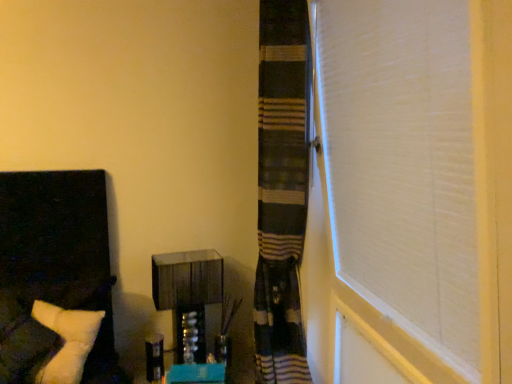
What is the approximate height of metallic glass vanity at center?

18.36 inches.

The width and height of the screenshot is (512, 384). Describe the element at coordinates (188, 290) in the screenshot. I see `metallic glass vanity at center` at that location.

Find the location of `metallic glass vanity at center`. metallic glass vanity at center is located at coordinates (188, 290).

The image size is (512, 384). I want to click on white soft pillow at left, so pos(54,268).

The width and height of the screenshot is (512, 384). What do you see at coordinates (54, 268) in the screenshot? I see `white soft pillow at left` at bounding box center [54, 268].

What are the coordinates of `metallic glass vanity at center` in the screenshot? It's located at (188, 290).

Based on their positions, is metallic glass vanity at center located to the left or right of white soft pillow at left?

metallic glass vanity at center is to the right of white soft pillow at left.

Does metallic glass vanity at center come in front of white soft pillow at left?

That is False.

Is point (178, 360) closer or farther from the camera than point (7, 341)?

Point (178, 360) is farther from the camera than point (7, 341).

From the image's perspective, is metallic glass vanity at center above white soft pillow at left?

No, from the image's perspective, metallic glass vanity at center is not on top of white soft pillow at left.

From a real-world perspective, which object stands above the other?

In real-world perspective, white soft pillow at left is above.

Between metallic glass vanity at center and white soft pillow at left, which one has smaller width?

With smaller width is metallic glass vanity at center.

Considering the sizes of objects metallic glass vanity at center and white soft pillow at left in the image provided, who is taller, metallic glass vanity at center or white soft pillow at left?

white soft pillow at left is taller.

Consider the image. Is metallic glass vanity at center bigger than white soft pillow at left?

No, metallic glass vanity at center is not bigger than white soft pillow at left.

Is white soft pillow at left located within metallic glass vanity at center?

No.

Is there a large distance between metallic glass vanity at center and white soft pillow at left?

That's not correct — metallic glass vanity at center is a little close to white soft pillow at left.

Could you tell me if metallic glass vanity at center is turned towards white soft pillow at left?

No, metallic glass vanity at center is not oriented towards white soft pillow at left.

Can you tell me how much metallic glass vanity at center and white soft pillow at left differ in facing direction?

11.7 degrees separate the facing orientations of metallic glass vanity at center and white soft pillow at left.

The height and width of the screenshot is (384, 512). Identify the location of furniture above the metallic glass vanity at center (from a real-world perspective). (54, 268).

Is white soft pillow at left at the left side of metallic glass vanity at center?

Indeed, white soft pillow at left is positioned on the left side of metallic glass vanity at center.

Which is in front, white soft pillow at left or metallic glass vanity at center?

white soft pillow at left.

Which is nearer, (95, 220) or (202, 332)?

Point (95, 220) is closer to the camera than point (202, 332).

From the image's perspective, between white soft pillow at left and metallic glass vanity at center, who is located below?

metallic glass vanity at center, from the image's perspective.

From a real-world perspective, is white soft pillow at left on top of metallic glass vanity at center?

Yes.

Looking at their sizes, would you say white soft pillow at left is wider or thinner than metallic glass vanity at center?

Considering their sizes, white soft pillow at left looks broader than metallic glass vanity at center.

Is white soft pillow at left shorter than metallic glass vanity at center?

No.

Considering the relative sizes of white soft pillow at left and metallic glass vanity at center in the image provided, is white soft pillow at left bigger than metallic glass vanity at center?

Yes.

Is white soft pillow at left inside or outside of metallic glass vanity at center?

white soft pillow at left is outside metallic glass vanity at center.

Are white soft pillow at left and metallic glass vanity at center located far from each other?

No, white soft pillow at left is not far away from metallic glass vanity at center.

Is white soft pillow at left facing towards metallic glass vanity at center?

No, white soft pillow at left is not facing towards metallic glass vanity at center.

What's the angular difference between white soft pillow at left and metallic glass vanity at center's facing directions?

The angular difference between white soft pillow at left and metallic glass vanity at center is 11.7 degrees.

Locate an element on the screen. vanity behind the white soft pillow at left is located at coordinates (188, 290).

You are a GUI agent. You are given a task and a screenshot of the screen. Output one action in this format:
    pyautogui.click(x=<x>, y=<y>)
    Task: Click on the vanity directly beneath the white soft pillow at left (from a real-world perspective)
    This screenshot has width=512, height=384.
    Given the screenshot: What is the action you would take?
    pyautogui.click(x=188, y=290)

Where is `furniture in front of the metallic glass vanity at center`? Image resolution: width=512 pixels, height=384 pixels. furniture in front of the metallic glass vanity at center is located at coordinates (54, 268).